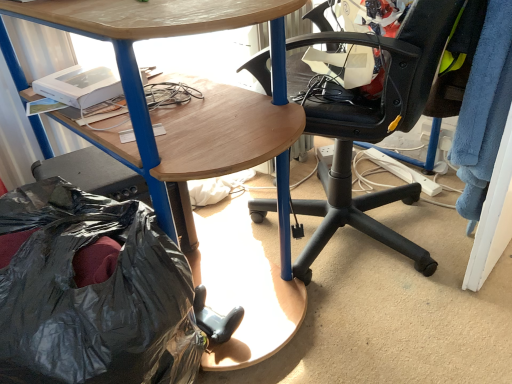
Identify the location of black plastic chair at center. (375, 129).

Which is in front, point (188, 343) or point (265, 199)?

Point (188, 343)

Which is more to the right, black plastic bag at lower left or black plastic chair at center?

From the viewer's perspective, black plastic chair at center appears more on the right side.

Where is `chair positioned vertically above the black plastic bag at lower left (from a real-world perspective)`? This screenshot has height=384, width=512. chair positioned vertically above the black plastic bag at lower left (from a real-world perspective) is located at coordinates (375, 129).

How many degrees apart are the facing directions of black plastic bag at lower left and black plastic chair at center?

161 degrees separate the facing orientations of black plastic bag at lower left and black plastic chair at center.

From the image's perspective, is wooden desk at center above or below black plastic bag at lower left?

Clearly, from the image's perspective, wooden desk at center is above black plastic bag at lower left.

Is wooden desk at center in front of black plastic bag at lower left?

No.

How different are the orientations of wooden desk at center and black plastic bag at lower left in degrees?

The facing directions of wooden desk at center and black plastic bag at lower left are 2.38 degrees apart.

The height and width of the screenshot is (384, 512). Find the location of `desk on the right of black plastic bag at lower left`. desk on the right of black plastic bag at lower left is located at coordinates (221, 131).

How much distance is there between black plastic chair at center and wooden desk at center?

black plastic chair at center is 10.17 inches away from wooden desk at center.

Is black plastic chair at center smaller than wooden desk at center?

Indeed, black plastic chair at center has a smaller size compared to wooden desk at center.

Are black plastic chair at center and wooden desk at center located far from each other?

They are positioned close to each other.

Can you confirm if wooden desk at center is bigger than black plastic chair at center?

Yes, wooden desk at center is bigger than black plastic chair at center.

Is wooden desk at center further to the viewer compared to black plastic chair at center?

No, it is in front of black plastic chair at center.

Considering the sizes of wooden desk at center and black plastic chair at center in the image, is wooden desk at center taller or shorter than black plastic chair at center?

In the image, wooden desk at center appears to be taller than black plastic chair at center.

Is black plastic bag at lower left at the right side of wooden desk at center?

No, black plastic bag at lower left is not to the right of wooden desk at center.

From a real-world perspective, between black plastic bag at lower left and wooden desk at center, who is vertically higher?

wooden desk at center.

What's the angular difference between black plastic bag at lower left and wooden desk at center's facing directions?

The angle between the facing direction of black plastic bag at lower left and the facing direction of wooden desk at center is 2.38 degrees.

Does black plastic bag at lower left turn towards wooden desk at center?

No, black plastic bag at lower left does not turn towards wooden desk at center.

Based on the photo, from the image's perspective, would you say black plastic chair at center is shown under black plastic bag at lower left?

No, from the image's perspective, black plastic chair at center is not beneath black plastic bag at lower left.

Is black plastic chair at center thinner than black plastic bag at lower left?

No, black plastic chair at center is not thinner than black plastic bag at lower left.

Is point (302, 273) in front of point (97, 326)?

No.

Between black plastic chair at center and black plastic bag at lower left, which one is positioned behind?

black plastic chair at center is behind.

Identify the location of chair behind the black plastic bag at lower left. The height and width of the screenshot is (384, 512). (375, 129).

Locate an element on the screen. The width and height of the screenshot is (512, 384). desk that is on the right side of black plastic bag at lower left is located at coordinates (221, 131).

Which object lies nearer to the anchor point black plastic bag at lower left, wooden desk at center or black plastic chair at center?

The object closer to black plastic bag at lower left is wooden desk at center.

Looking at this image, which object lies further to the anchor point wooden desk at center, black plastic bag at lower left or black plastic chair at center?

Based on the image, black plastic chair at center appears to be further to wooden desk at center.

Considering their positions, is black plastic bag at lower left positioned further to black plastic chair at center than wooden desk at center?

Among the two, black plastic bag at lower left is located further to black plastic chair at center.

From the image, which object appears to be nearer to black plastic bag at lower left, black plastic chair at center or wooden desk at center?

The object closer to black plastic bag at lower left is wooden desk at center.

Looking at the image, which one is located closer to black plastic chair at center, wooden desk at center or black plastic bag at lower left?

wooden desk at center lies closer to black plastic chair at center than the other object.

Looking at the image, which one is located further to wooden desk at center, black plastic chair at center or black plastic bag at lower left?

The object further to wooden desk at center is black plastic chair at center.

You are a GUI agent. You are given a task and a screenshot of the screen. Output one action in this format:
    pyautogui.click(x=<x>, y=<y>)
    Task: Click on the chair that lies between wooden desk at center and black plastic bag at lower left from top to bottom
    
    Given the screenshot: What is the action you would take?
    pyautogui.click(x=375, y=129)